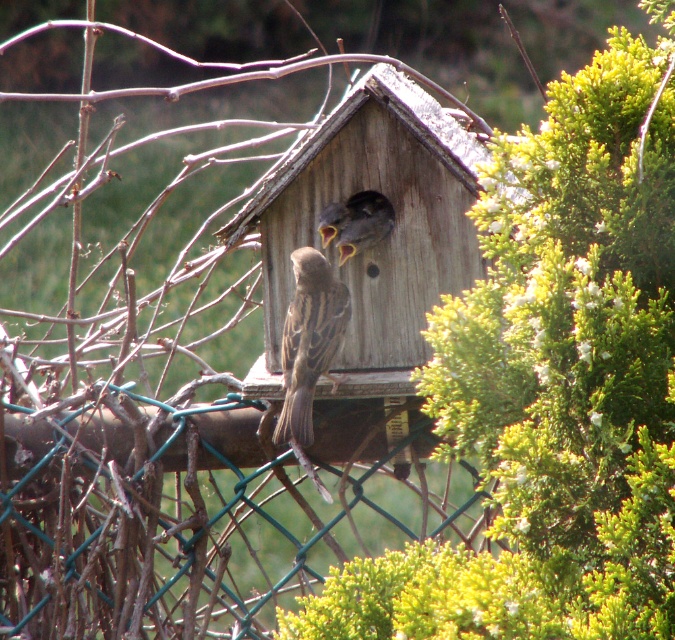
Consider the image. You are holding a camera and want to take a photo of the green wire mesh at center. If you are standing 6 feet away from the camera, can you reach the camera to take the photo?

The green wire mesh at center and camera are 7.06 feet apart from each other. Since you are standing 6 feet away from the camera, the total distance between you and the green wire mesh at center would be 6 feet plus the distance from you to the camera. However, the question is about reaching the camera itself. If you are 6 feet away from the camera, you are within arm s reach to grab it, so yes, you can reach the camera to take the photo.

You are a gardener wanting to plant a new shrub that requires more sunlight. You observe the green leafy bush at upper right and the green wire mesh at center. Which object should you place the shrub near to ensure it gets enough sunlight?

The green leafy bush at upper right is taller than the green wire mesh at center. Therefore, placing the shrub near the green wire mesh at center would allow it to receive more sunlight since the taller bush might block sunlight from reaching it.

You are a gardener planning to trim the green leafy bush at upper right and the green wire mesh at center. Which object requires a wider path for access?

The green wire mesh at center requires a wider path because the green leafy bush at upper right is narrower than the green wire mesh at center.